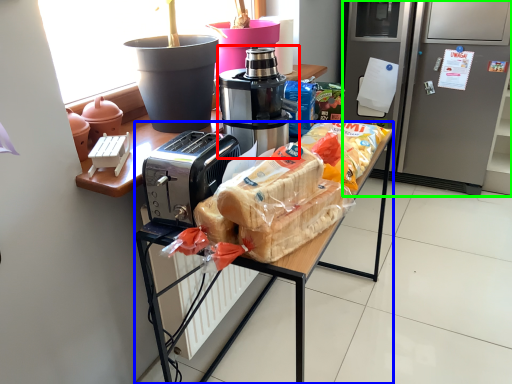
Question: Considering the real-world distances, which object is farthest from coffee maker (highlighted by a red box)? desk (highlighted by a blue box) or home appliance (highlighted by a green box)?

Choices:
 (A) desk
 (B) home appliance

Answer: (B)